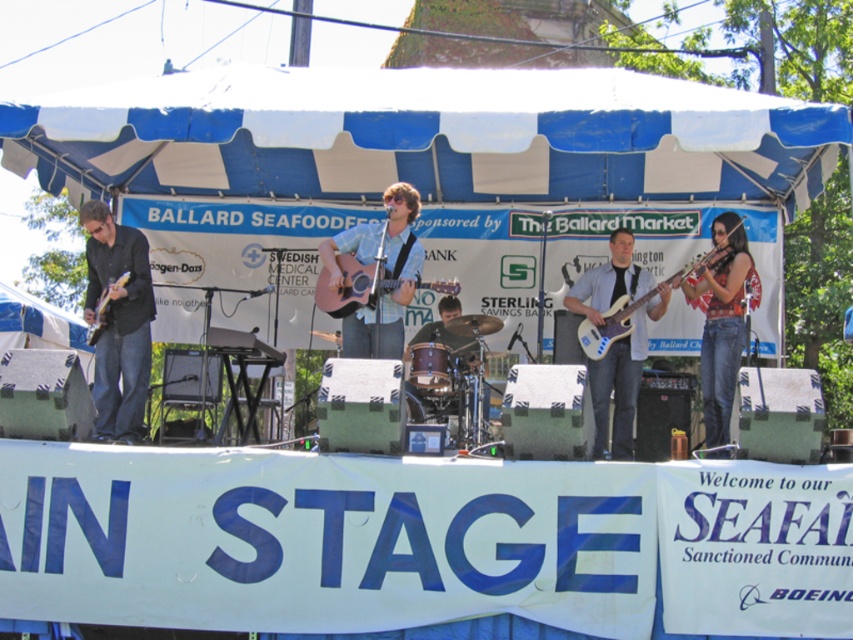
Question: Which of the following is the closest to the observer?

Choices:
 (A) (397, 266)
 (B) (612, 336)
 (C) (137, 282)

Answer: (A)

Question: Is light blue fabric guitar at center below blue denim jeans at center?

Choices:
 (A) no
 (B) yes

Answer: (A)

Question: Where is blue/white striped canopy at upper center located in relation to blue denim jeans at center in the image?

Choices:
 (A) left
 (B) right

Answer: (A)

Question: Which point is farther to the camera?

Choices:
 (A) 376,321
 (B) 726,96
 (C) 846,346
 (D) 97,301

Answer: (C)

Question: Which of the following is the closest to the observer?

Choices:
 (A) matte brown acoustic guitar at left
 (B) glossy electric guitar at center-right
 (C) blue/white striped canopy at upper center
 (D) blue denim jeans at center

Answer: (C)

Question: Is light blue fabric guitar at center further to camera compared to glossy electric guitar at center-right?

Choices:
 (A) yes
 (B) no

Answer: (B)